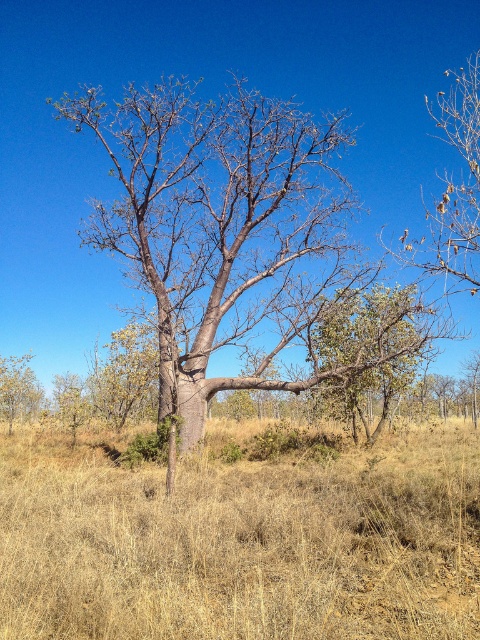
Question: Which object appears closest to the camera in this image?

Choices:
 (A) bark-like textured tree at center
 (B) dry grass at center

Answer: (B)

Question: Which object is positioned farthest from the green leafy tree at left?

Choices:
 (A) bare branches at upper right
 (B) dry grass at center
 (C) bark-like textured tree at center

Answer: (A)

Question: Can you confirm if dry grass at center is positioned above bark-like textured tree at center?

Choices:
 (A) no
 (B) yes

Answer: (A)

Question: Considering the relative positions of dry grass at center and bare branches at upper right in the image provided, where is dry grass at center located with respect to bare branches at upper right?

Choices:
 (A) left
 (B) right

Answer: (A)

Question: Can you confirm if bark-like textured tree at center is positioned below green leafy tree at left?

Choices:
 (A) yes
 (B) no

Answer: (B)

Question: Estimate the real-world distances between objects in this image. Which object is closer to the dry grass at center?

Choices:
 (A) bare branches at upper right
 (B) bark-like textured tree at center
 (C) green leafy tree at left

Answer: (B)